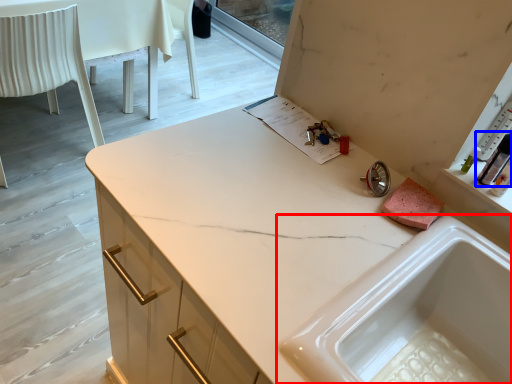
Question: Among these objects, which one is nearest to the camera, sink (highlighted by a red box) or toiletry (highlighted by a blue box)?

Choices:
 (A) sink
 (B) toiletry

Answer: (A)